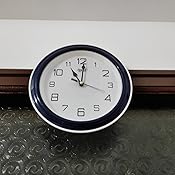
Locate an element on the screen. This screenshot has width=175, height=175. black rim around clock is located at coordinates (102, 126).